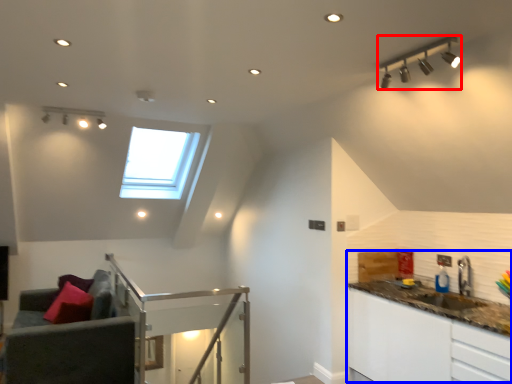
Question: Which object is further to the camera taking this photo, light fixture (highlighted by a red box) or counter top (highlighted by a blue box)?

Choices:
 (A) light fixture
 (B) counter top

Answer: (B)